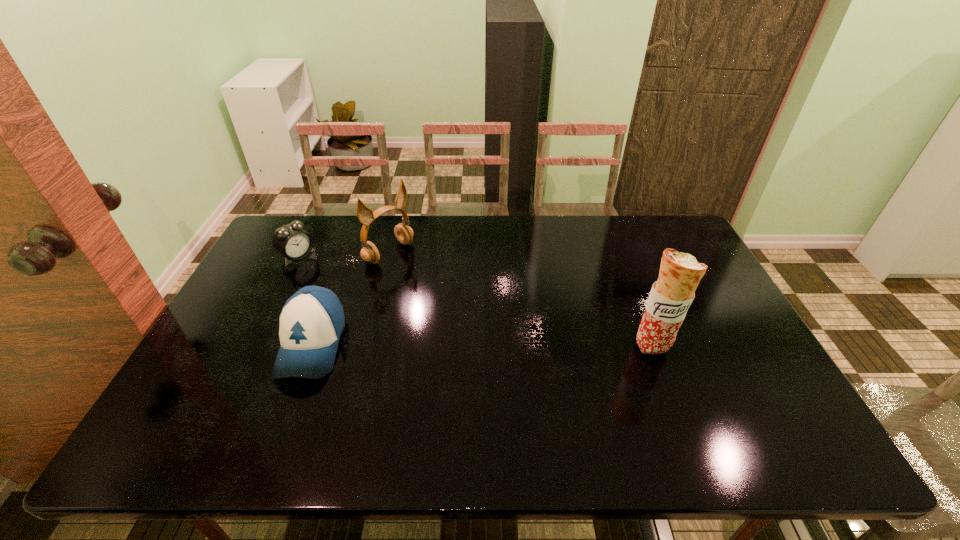
Locate an element on the screen. vacant spot on the desktop that is between the baseball cap and the tallest object and is positioned on the front-facing side of the second tallest object is located at coordinates (530, 346).

This screenshot has height=540, width=960. I want to click on free spot on the desktop that is between the baseball cap and the burrito and is positioned on the front side of the alarm clock, so click(x=441, y=345).